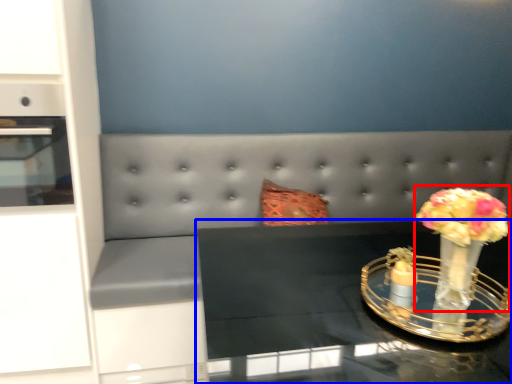
Question: Among these objects, which one is farthest to the camera, floral arrangement (highlighted by a red box) or table (highlighted by a blue box)?

Choices:
 (A) floral arrangement
 (B) table

Answer: (A)